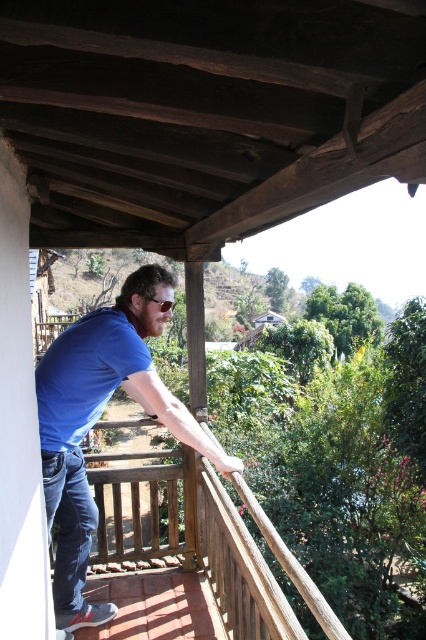
Question: Is blue cotton shirt at center wider than blue denim jeans at lower left?

Choices:
 (A) yes
 (B) no

Answer: (A)

Question: Is blue cotton shirt at center thinner than blue denim jeans at lower left?

Choices:
 (A) yes
 (B) no

Answer: (B)

Question: Can you confirm if blue cotton shirt at center is positioned to the left of blue denim jeans at lower left?

Choices:
 (A) yes
 (B) no

Answer: (B)

Question: Among these points, which one is farthest from the camera?

Choices:
 (A) (118, 330)
 (B) (134, 508)
 (C) (74, 557)

Answer: (B)

Question: Among these objects, which one is nearest to the camera?

Choices:
 (A) blue denim jeans at lower left
 (B) blue cotton shirt at center

Answer: (B)

Question: Considering the real-world distances, which object is closest to the blue denim jeans at lower left?

Choices:
 (A) wooden railing at upper center
 (B) blue cotton shirt at center

Answer: (B)